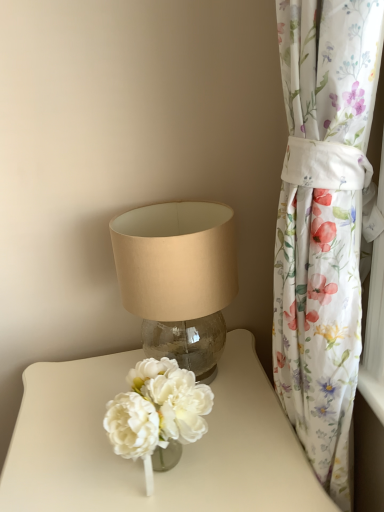
Question: Looking at the image, does translucent glass vase at center seem bigger or smaller compared to floral fabric curtain at right?

Choices:
 (A) small
 (B) big

Answer: (B)

Question: From their relative heights in the image, would you say translucent glass vase at center is taller or shorter than floral fabric curtain at right?

Choices:
 (A) tall
 (B) short

Answer: (B)

Question: Which of these objects is positioned farthest from the translucent glass vase at center?

Choices:
 (A) floral fabric curtain at right
 (B) beige fabric lampshade at center

Answer: (A)

Question: Which of these objects is positioned closest to the floral fabric curtain at right?

Choices:
 (A) beige fabric lampshade at center
 (B) translucent glass vase at center

Answer: (A)